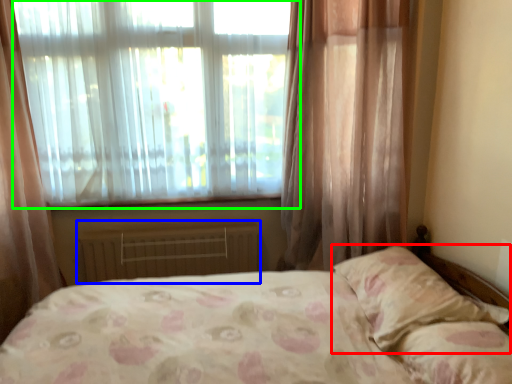
Question: Considering the real-world distances, which object is farthest from pillow (highlighted by a red box)? radiator (highlighted by a blue box) or window (highlighted by a green box)?

Choices:
 (A) radiator
 (B) window

Answer: (B)